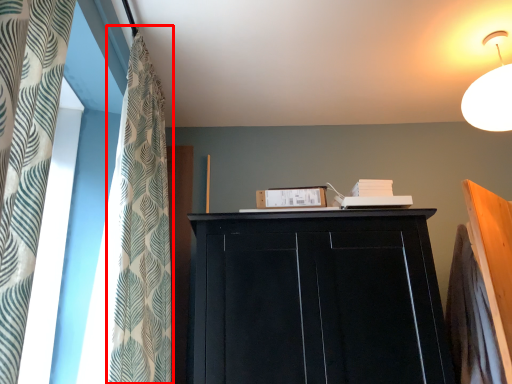
Question: Considering the relative positions of shower curtain (annotated by the red box) and cupboard in the image provided, where is shower curtain (annotated by the red box) located with respect to the staircase?

Choices:
 (A) right
 (B) left

Answer: (B)